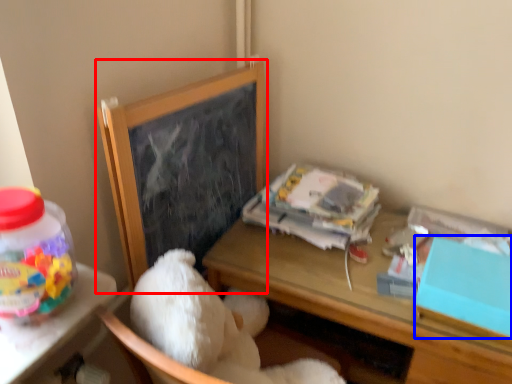
Question: Which of the following is the farthest to the observer, bulletin board (highlighted by a red box) or box (highlighted by a blue box)?

Choices:
 (A) bulletin board
 (B) box

Answer: (A)